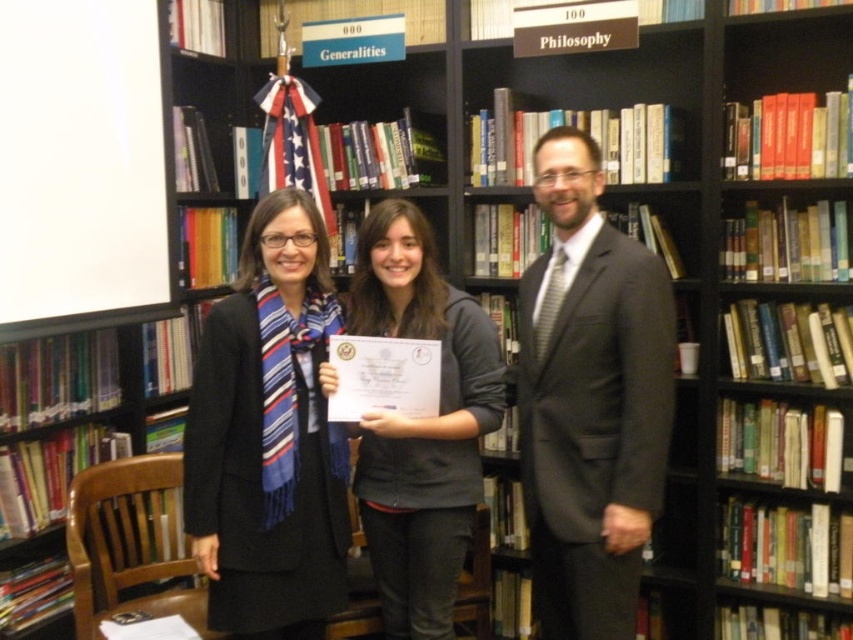
Question: Which of the following is the farthest from the observer?

Choices:
 (A) gray suit at center
 (B) black wool coat at center
 (C) gray fabric jacket at center

Answer: (C)

Question: In this image, where is gray suit at center located relative to gray fabric jacket at center?

Choices:
 (A) above
 (B) below

Answer: (A)

Question: Is gray suit at center bigger than black wool coat at center?

Choices:
 (A) no
 (B) yes

Answer: (B)

Question: Based on their relative distances, which object is farther from the gray fabric jacket at center?

Choices:
 (A) gray suit at center
 (B) black wool coat at center

Answer: (A)

Question: Does black wool coat at center come behind gray fabric jacket at center?

Choices:
 (A) yes
 (B) no

Answer: (B)

Question: Which object is positioned farthest from the gray suit at center?

Choices:
 (A) black wool coat at center
 (B) gray fabric jacket at center

Answer: (A)